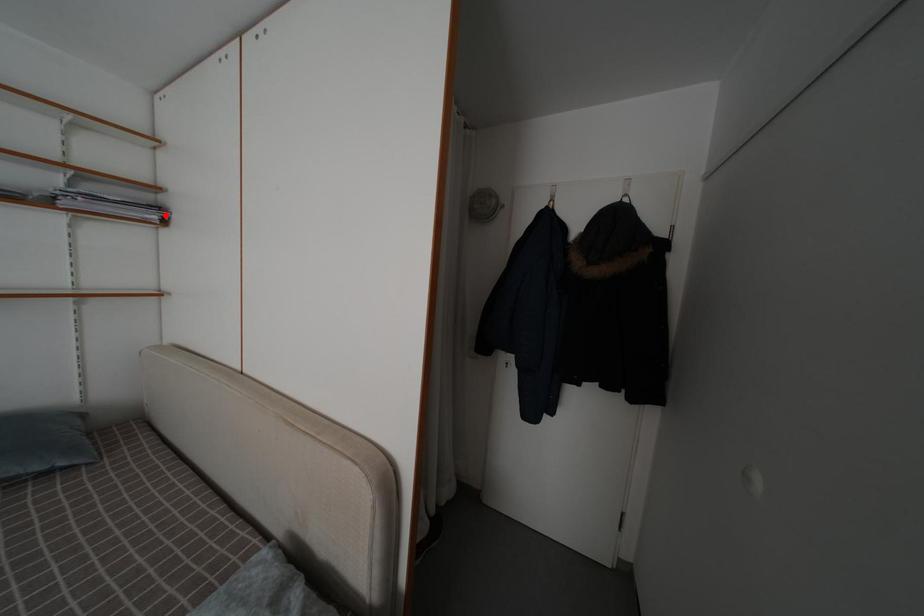
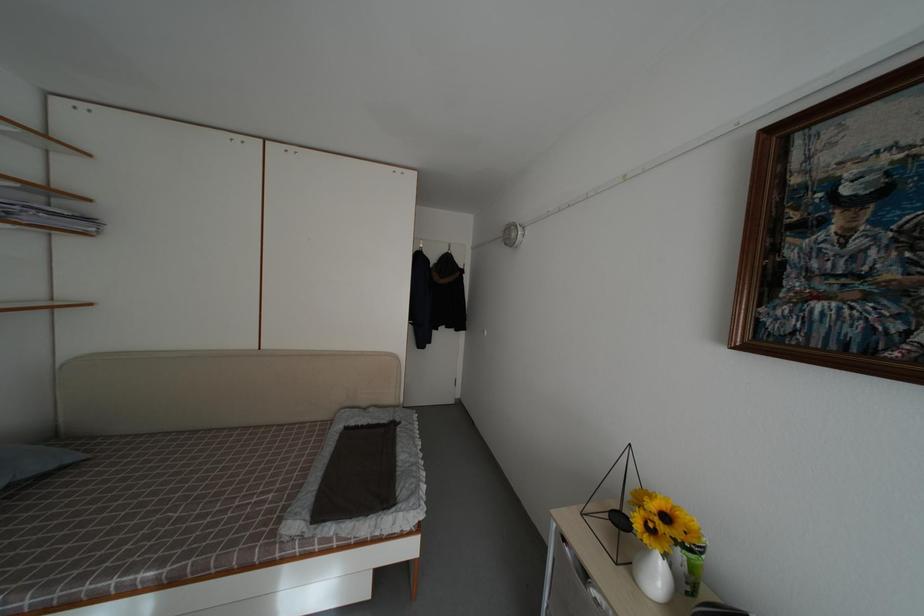
Question: I am providing you with two images of the same scene from different viewpoints. A red point is marked on the first image. At the location where the point appears in image 1, is it still visible in image 2?

Choices:
 (A) Yes
 (B) No

Answer: (A)